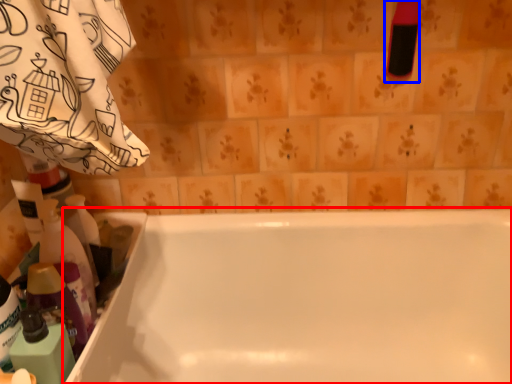
Question: Among these objects, which one is nearest to the camera, bathtub (highlighted by a red box) or cleaning product (highlighted by a blue box)?

Choices:
 (A) bathtub
 (B) cleaning product

Answer: (A)